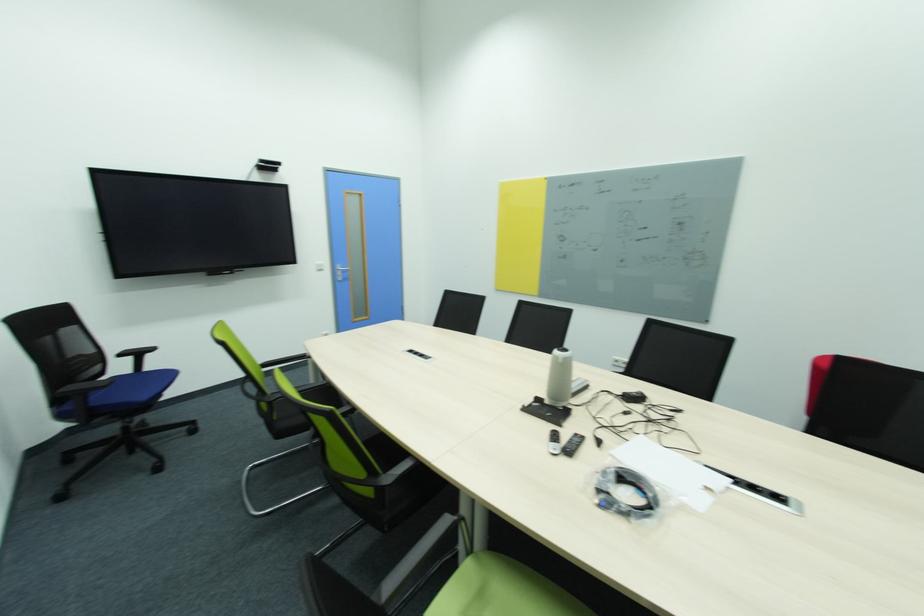
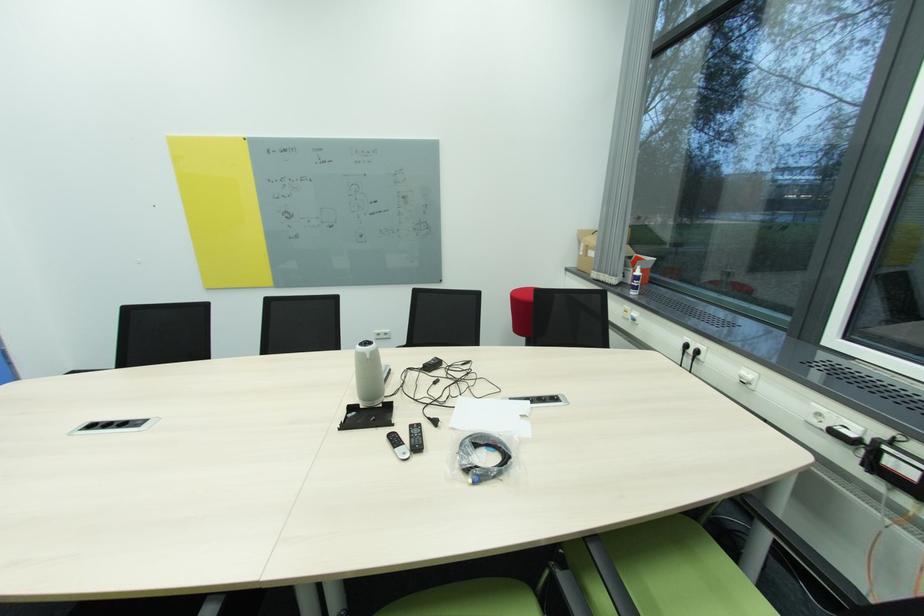
Where in the second image is the point corresponding to (x=560, y=450) from the first image?

(408, 455)